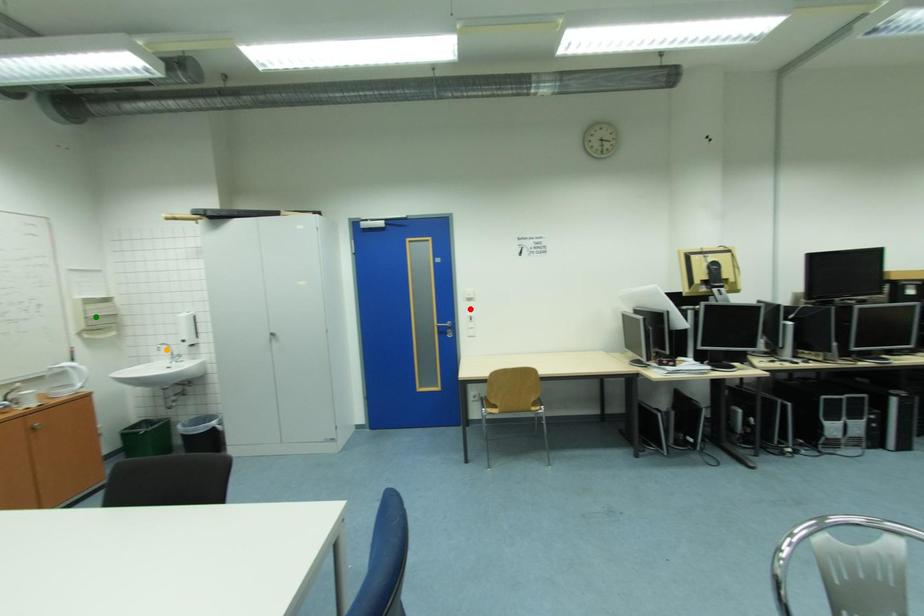
Based on the photo, order these from nearest to farthest:
red point | green point | orange point

green point → orange point → red point